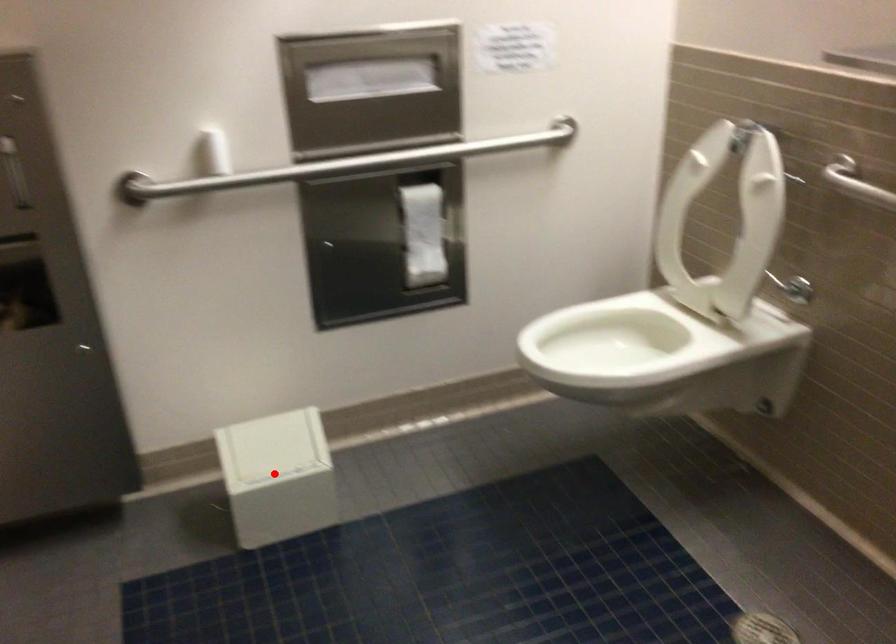
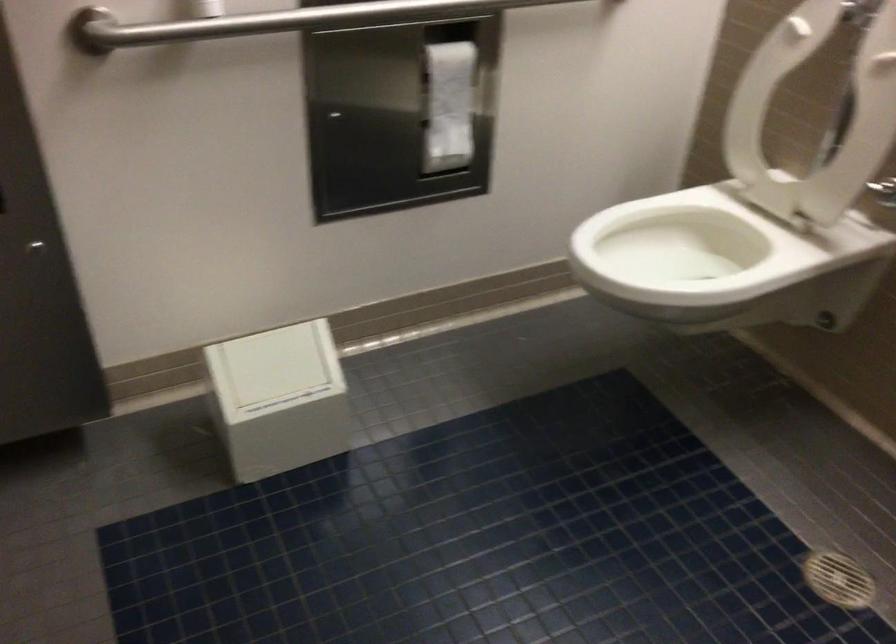
Find the pixel in the second image that matches the highlighted location in the first image.

(279, 399)